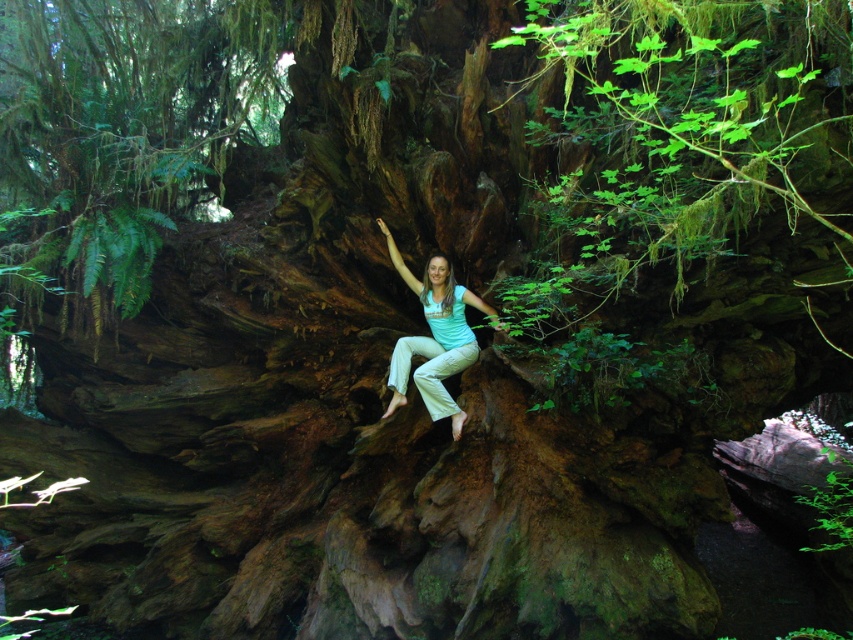
Question: Is green mossy tree trunk at center closer to camera compared to light blue cotton shirt at center?

Choices:
 (A) no
 (B) yes

Answer: (B)

Question: Among these objects, which one is farthest from the camera?

Choices:
 (A) green mossy tree trunk at center
 (B) light blue cotton shirt at center

Answer: (B)

Question: Is green mossy tree trunk at center to the right of light blue cotton shirt at center from the viewer's perspective?

Choices:
 (A) no
 (B) yes

Answer: (A)

Question: In this image, where is green mossy tree trunk at center located relative to light blue cotton shirt at center?

Choices:
 (A) above
 (B) below

Answer: (A)